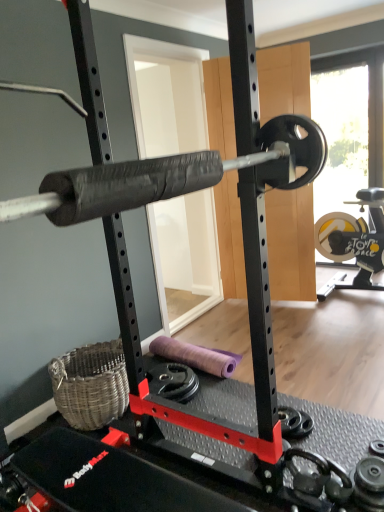
Image resolution: width=384 pixels, height=512 pixels. Identify the location of free location above black rubber dumbbell at lower right (from a real-world perspective). (293, 418).